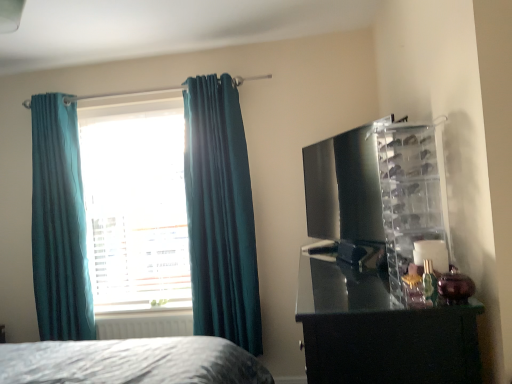
Where is `free space above white matte radiator at lower left (from a real-world perspective)`? The height and width of the screenshot is (384, 512). free space above white matte radiator at lower left (from a real-world perspective) is located at coordinates (145, 315).